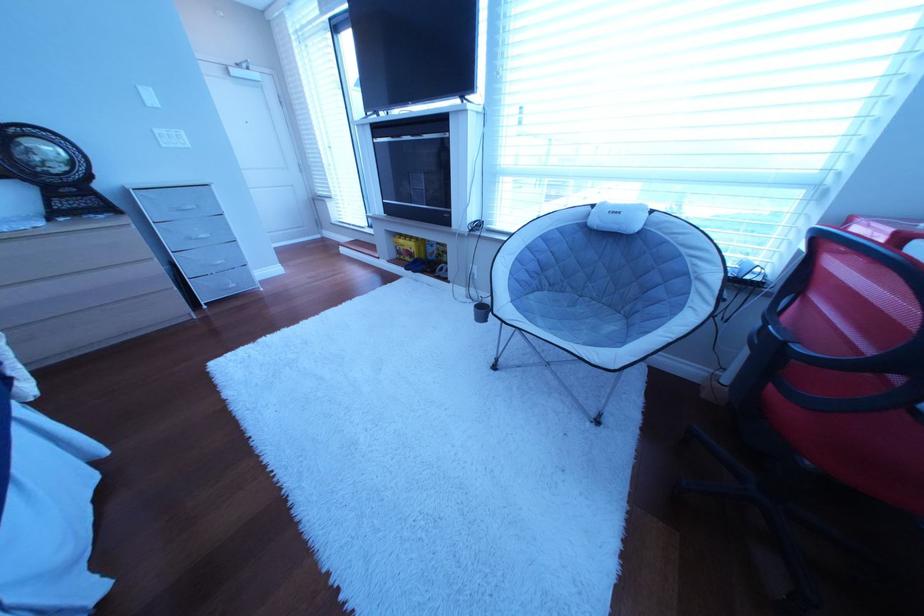
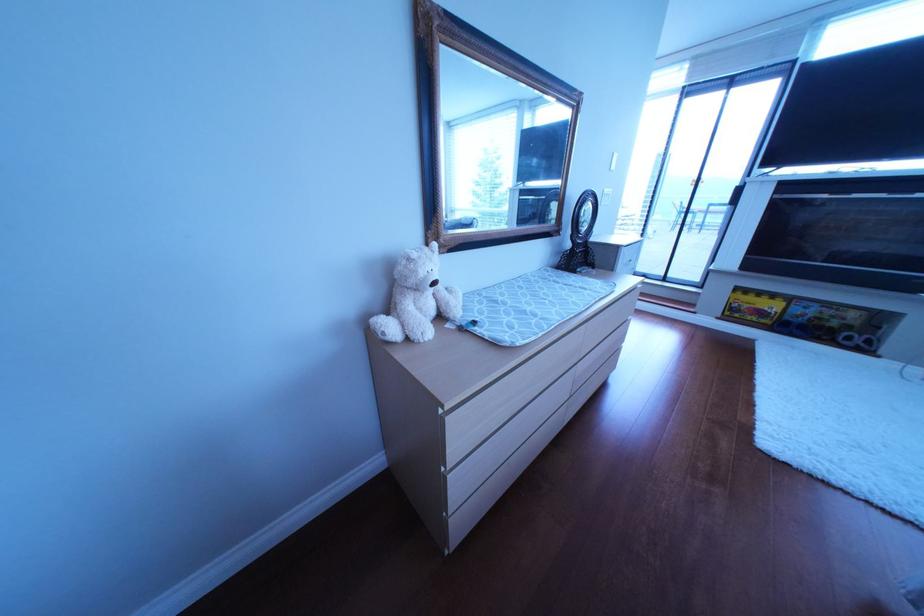
Question: The images are taken continuously from a first-person perspective. In which direction are you moving?

Choices:
 (A) Left
 (B) Right
 (C) Forward
 (D) Backward

Answer: (A)